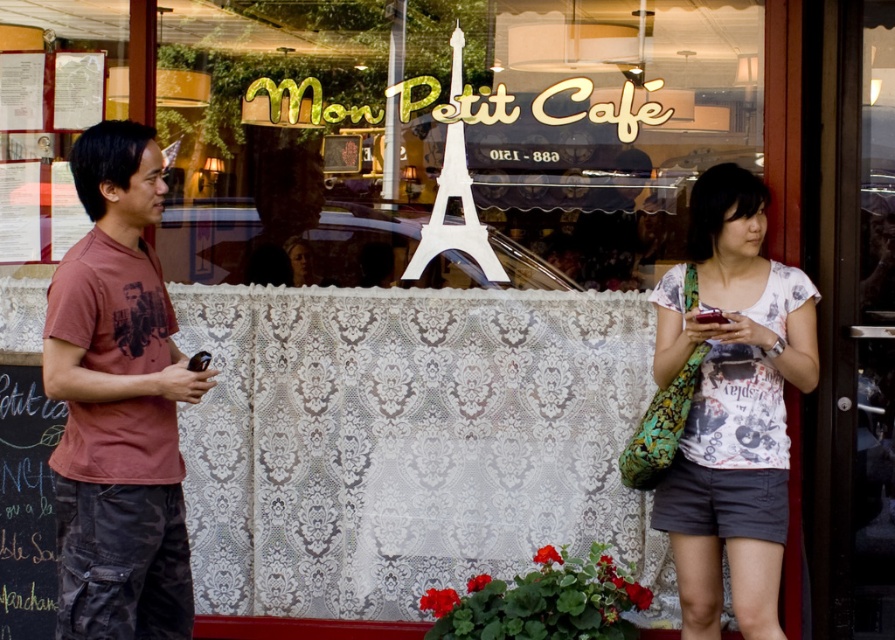
Is black chalkboard at left positioned before white plastic eiffel tower at center?

No, black chalkboard at left is behind white plastic eiffel tower at center.

Is black chalkboard at left to the left of white plastic eiffel tower at center from the viewer's perspective?

Indeed, black chalkboard at left is positioned on the left side of white plastic eiffel tower at center.

Find the location of a particular element. The height and width of the screenshot is (640, 895). black chalkboard at left is located at coordinates (26, 502).

Does point (111, 227) come farther from viewer compared to point (24, 499)?

That is False.

Does matte red t-shirt at left appear on the left side of black chalkboard at left?

In fact, matte red t-shirt at left is to the right of black chalkboard at left.

Is point (109, 572) farther from camera compared to point (16, 516)?

No, it is not.

You are a GUI agent. You are given a task and a screenshot of the screen. Output one action in this format:
    pyautogui.click(x=<x>, y=<y>)
    Task: Click on the matte red t-shirt at left
    The height and width of the screenshot is (640, 895).
    Given the screenshot: What is the action you would take?
    pyautogui.click(x=118, y=404)

Does white printed shirt at center have a lesser height compared to black chalkboard at left?

Incorrect, white printed shirt at center's height does not fall short of black chalkboard at left's.

Based on the photo, is white printed shirt at center taller than black chalkboard at left?

Yes.

Is point (700, 520) farther from camera compared to point (19, 564)?

No, (700, 520) is closer to viewer.

I want to click on white printed shirt at center, so click(x=731, y=406).